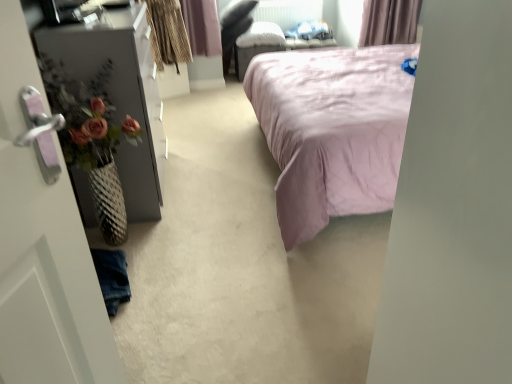
Question: From a real-world perspective, is pink satin bed at center beneath matte black dresser at left?

Choices:
 (A) yes
 (B) no

Answer: (B)

Question: Can we say pink satin bed at center lies outside matte black dresser at left?

Choices:
 (A) no
 (B) yes

Answer: (B)

Question: Is the depth of pink satin bed at center less than that of matte black dresser at left?

Choices:
 (A) no
 (B) yes

Answer: (B)

Question: Would you say matte black dresser at left is part of pink satin bed at center's contents?

Choices:
 (A) no
 (B) yes

Answer: (A)

Question: From a real-world perspective, is pink satin bed at center physically above matte black dresser at left?

Choices:
 (A) no
 (B) yes

Answer: (B)

Question: From a real-world perspective, is white plastic radiator at upper center positioned above or below matte black dresser at left?

Choices:
 (A) below
 (B) above

Answer: (B)

Question: Would you say white plastic radiator at upper center is to the left or to the right of matte black dresser at left in the picture?

Choices:
 (A) right
 (B) left

Answer: (A)

Question: Is white plastic radiator at upper center bigger or smaller than matte black dresser at left?

Choices:
 (A) small
 (B) big

Answer: (A)

Question: From their relative heights in the image, would you say white plastic radiator at upper center is taller or shorter than matte black dresser at left?

Choices:
 (A) tall
 (B) short

Answer: (B)

Question: Considering the positions of pink satin bed at center and white plastic radiator at upper center in the image, is pink satin bed at center wider or thinner than white plastic radiator at upper center?

Choices:
 (A) wide
 (B) thin

Answer: (A)

Question: In the image, is pink satin bed at center on the left side or the right side of white plastic radiator at upper center?

Choices:
 (A) right
 (B) left

Answer: (A)

Question: Relative to white plastic radiator at upper center, is pink satin bed at center in front or behind?

Choices:
 (A) behind
 (B) front

Answer: (B)

Question: From a real-world perspective, is pink satin bed at center above or below white plastic radiator at upper center?

Choices:
 (A) below
 (B) above

Answer: (B)

Question: Is pink satin bed at center inside the boundaries of matte black dresser at left, or outside?

Choices:
 (A) inside
 (B) outside

Answer: (B)

Question: Looking at their shapes, would you say pink satin bed at center is wider or thinner than matte black dresser at left?

Choices:
 (A) thin
 (B) wide

Answer: (B)